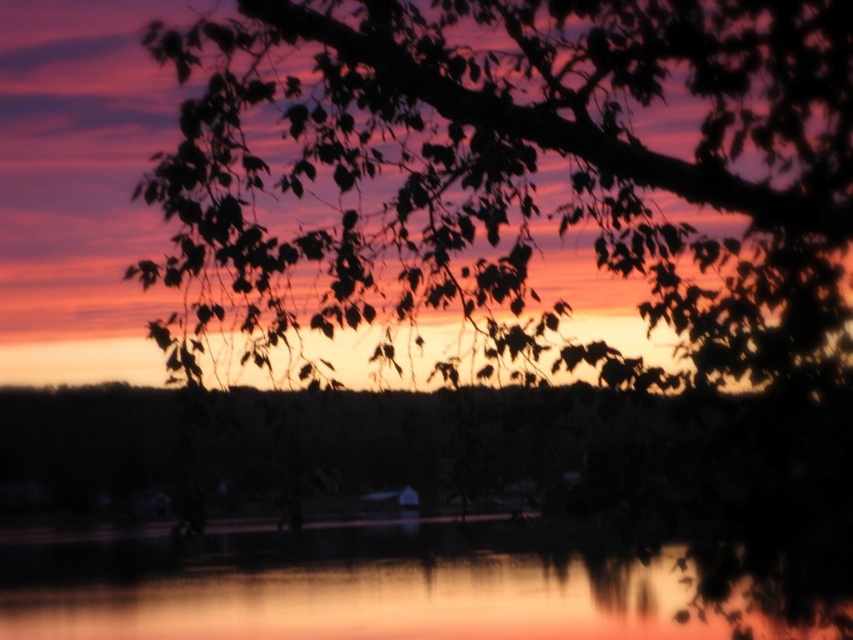
You are an artist planning to paint the sunset scene. You want to ensure the silhouette leaves at upper center and smooth water at center are proportionally accurate. Which object should you paint first to maintain the correct size relationship?

The silhouette leaves at upper center should be painted first since it is taller than the smooth water at center, allowing you to establish the vertical scale before adding the shorter element.

In the scene shown: You are standing at the point closest to the horizon in the sunset scene. Which of the two points, point [193,179] or point [126,589], is closer to you?

Point [126,589] is closer to you because it is behind point [193,179], which is in front of it.